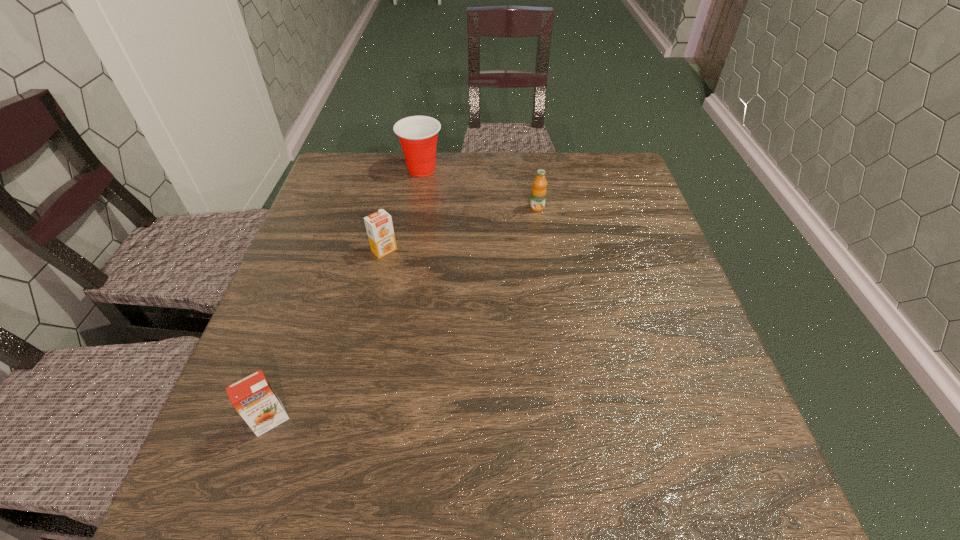
The height and width of the screenshot is (540, 960). What are the coordinates of `vacant space in between the nearest object and the rightmost orange juice` in the screenshot? It's located at (404, 314).

Identify which object is the second closest to the farthest object. Please provide its 2D coordinates. Your answer should be formatted as a tuple, i.e. [(x, y)], where the tuple contains the x and y coordinates of a point satisfying the conditions above.

[(538, 196)]

Where is `object that can be found as the closest to the second nearest object`? Image resolution: width=960 pixels, height=540 pixels. object that can be found as the closest to the second nearest object is located at coordinates tap(418, 135).

Image resolution: width=960 pixels, height=540 pixels. I want to click on orange juice that is the closest to the tallest object, so click(x=379, y=226).

Select which orange juice is the closest to the second nearest orange juice. Please provide its 2D coordinates. Your answer should be formatted as a tuple, i.e. [(x, y)], where the tuple contains the x and y coordinates of a point satisfying the conditions above.

[(538, 196)]

The width and height of the screenshot is (960, 540). Identify the location of vacant space that satisfies the following two spatial constraints: 1. on the back side of the second farthest orange juice; 2. on the right side of the farthest object. (402, 169).